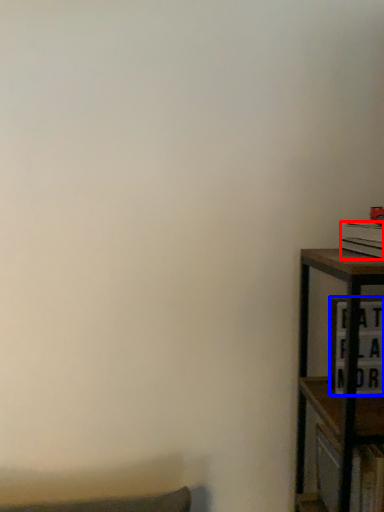
Question: Among these objects, which one is farthest to the camera, book (highlighted by a red box) or cabinet (highlighted by a blue box)?

Choices:
 (A) book
 (B) cabinet

Answer: (B)